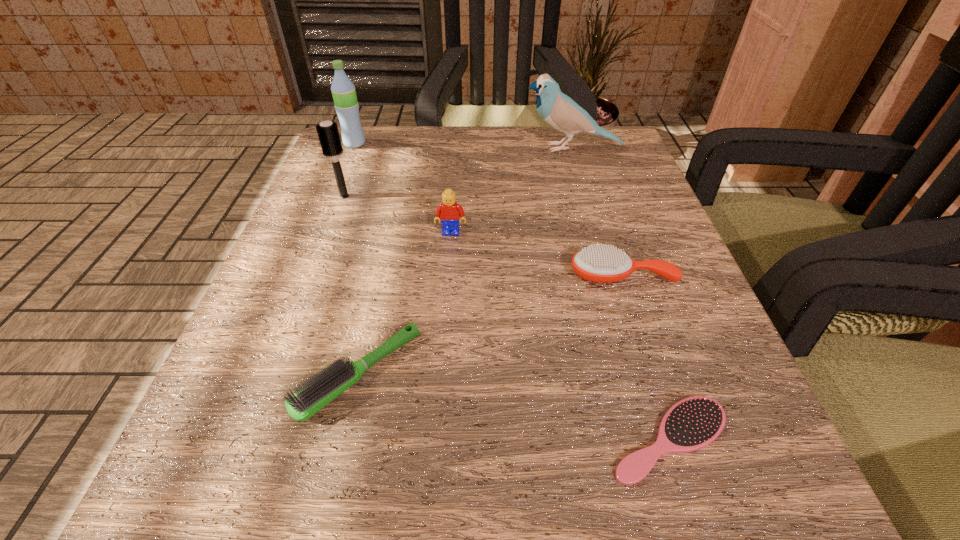
At what (x,y) coordinates should I click in order to perform the action: click on the shortest object. Please return your answer as a coordinate pair (x, y). This screenshot has width=960, height=540. Looking at the image, I should click on (693, 423).

Find the location of a particular element. vacant space positioned on the right of the water bottle is located at coordinates (448, 144).

Where is `free spot located 0.400m at the face of the bird`? This screenshot has width=960, height=540. free spot located 0.400m at the face of the bird is located at coordinates (333, 148).

Where is `vacant space positioned at the face of the bird`? This screenshot has height=540, width=960. vacant space positioned at the face of the bird is located at coordinates (333, 148).

Locate an element on the screen. free spot located 0.110m at the face of the bird is located at coordinates (468, 148).

The image size is (960, 540). What are the coordinates of `free space located on the right of the farthest hairbrush` in the screenshot? It's located at (498, 196).

Image resolution: width=960 pixels, height=540 pixels. I want to click on free space located on the front-facing side of the fourth tallest object, so click(x=444, y=320).

Locate an element on the screen. The height and width of the screenshot is (540, 960). vacant space located 0.220m on the front of the third shortest object is located at coordinates (671, 431).

This screenshot has height=540, width=960. In order to click on vacant space located on the back of the second shortest object in this screenshot , I will do `click(393, 225)`.

Identify the location of free location located 0.350m on the back of the shortest object. (601, 219).